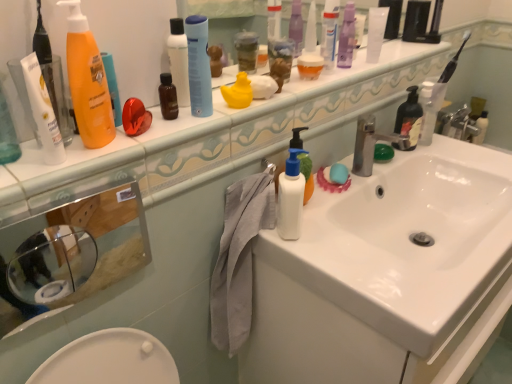
Find the location of `unoccupied region to the right of orange matte bottle at upper left, marked as the third cleaning product in a right-to-left arrangement`. unoccupied region to the right of orange matte bottle at upper left, marked as the third cleaning product in a right-to-left arrangement is located at coordinates (172, 137).